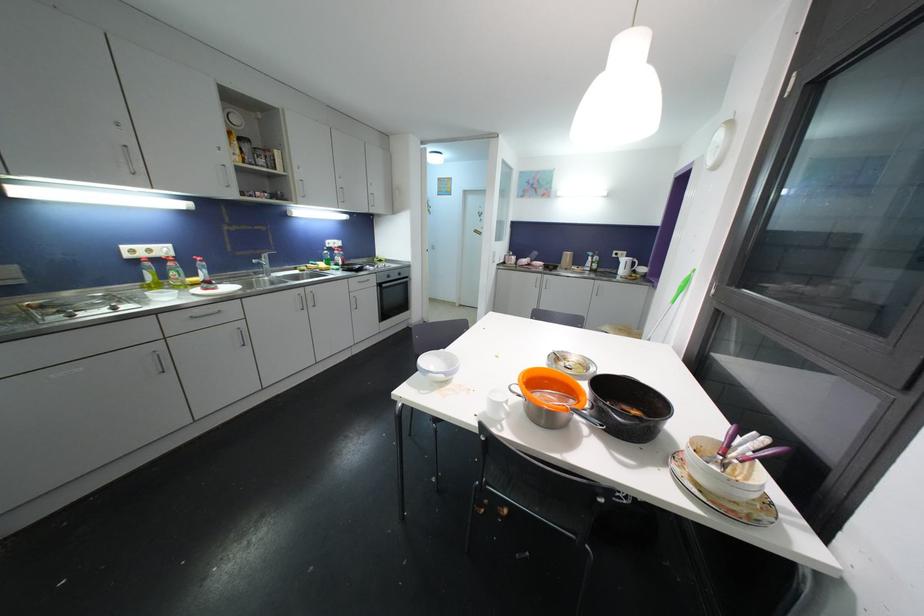
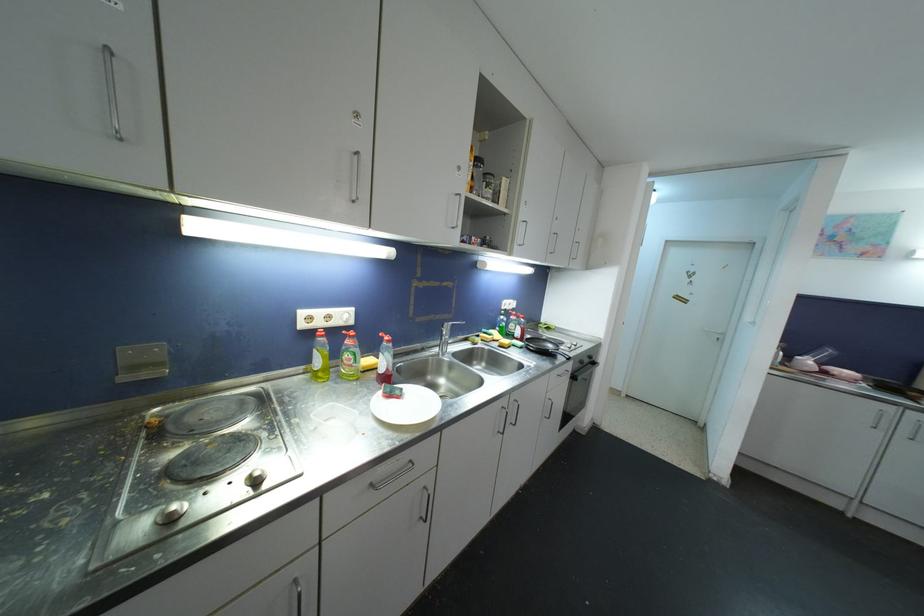
In a continuous first-person perspective shot, in which direction is the camera moving?

The cameraman moved toward left, forward.